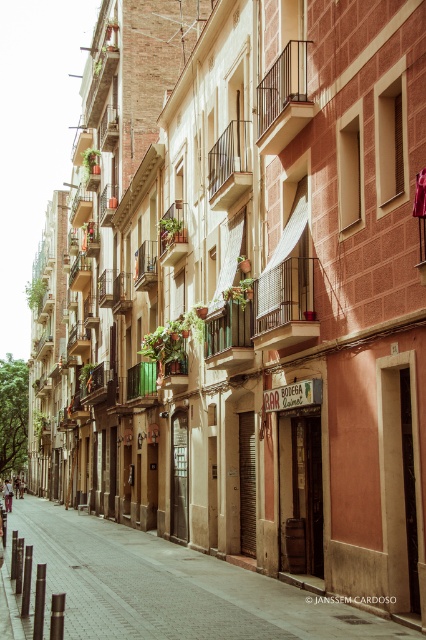
Question: Estimate the real-world distances between objects in this image. Which object is farther from the smooth brick pavement at center?

Choices:
 (A) metallic mesh balcony at center
 (B) wooden balcony at center

Answer: (A)

Question: Is smooth brick pavement at center below wooden balcony at center?

Choices:
 (A) no
 (B) yes

Answer: (B)

Question: Which of the following is the closest to the observer?

Choices:
 (A) (262, 80)
 (B) (218, 333)

Answer: (A)

Question: Can you confirm if smooth brick pavement at center is bigger than wooden balcony at center?

Choices:
 (A) no
 (B) yes

Answer: (B)

Question: Which of these objects is positioned closest to the wooden balcony at center?

Choices:
 (A) metallic mesh balcony at center
 (B) smooth brick pavement at center

Answer: (A)

Question: Does metallic mesh balcony at center have a smaller size compared to wooden balcony at center?

Choices:
 (A) no
 (B) yes

Answer: (A)